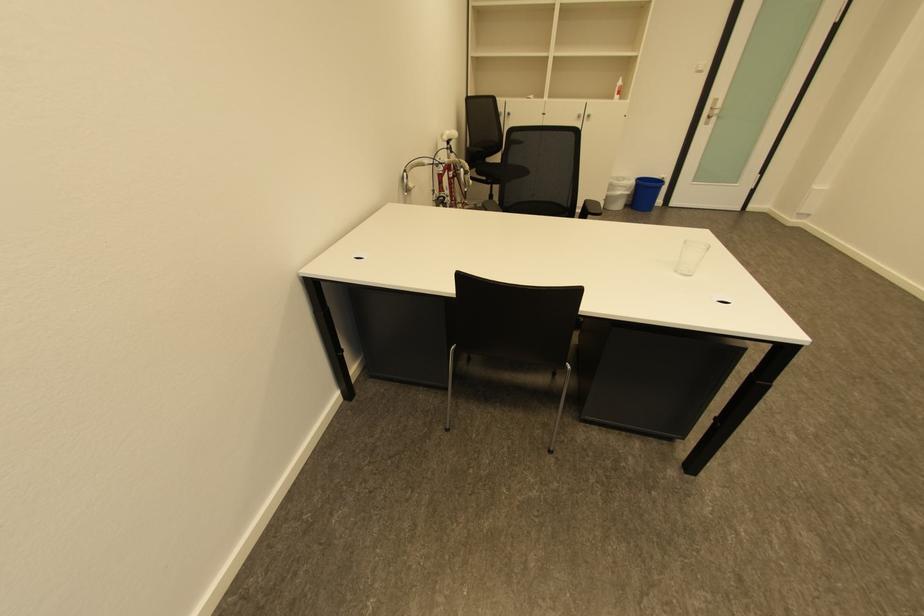
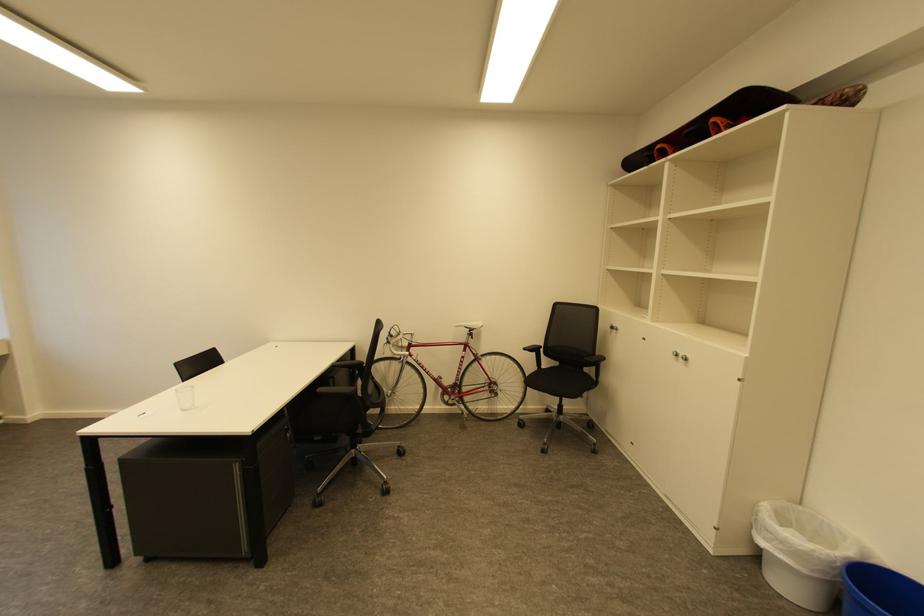
Locate, in the second image, the point that corresponds to the point at 626,188 in the first image.

(775, 533)